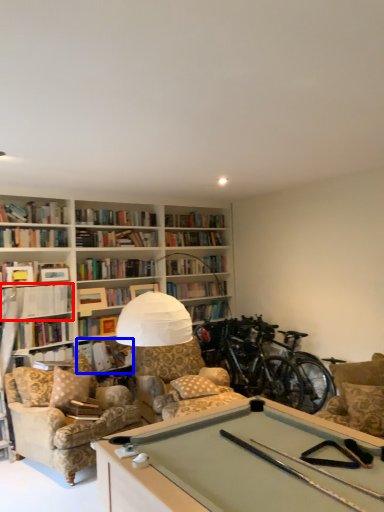
Question: Among these objects, which one is farthest to the camera, book (highlighted by a red box) or book (highlighted by a blue box)?

Choices:
 (A) book
 (B) book

Answer: (B)